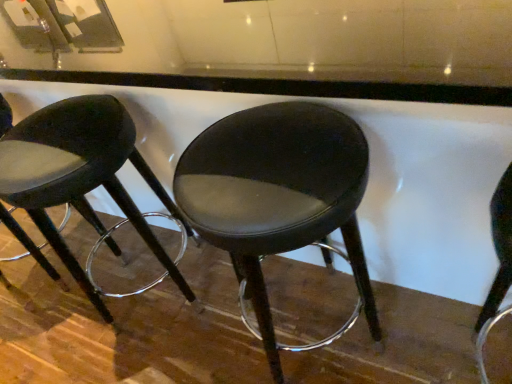
Question: Is matte black stool at center, which is the 1th stool from left to right, taller or shorter than black leather stool at center, the 1th stool when ordered from right to left?

Choices:
 (A) tall
 (B) short

Answer: (B)

Question: From a real-world perspective, is matte black stool at center, which is the 1th stool from left to right, physically located above or below black leather stool at center, the 1th stool when ordered from right to left?

Choices:
 (A) below
 (B) above

Answer: (B)

Question: In the image, is matte black stool at center, which is the 1th stool from left to right, on the left side or the right side of black leather stool at center, the 1th stool when ordered from right to left?

Choices:
 (A) left
 (B) right

Answer: (A)

Question: From the image's perspective, is black leather stool at center, the 1th stool when ordered from right to left, located above or below matte black stool at center, which is the 1th stool from left to right?

Choices:
 (A) below
 (B) above

Answer: (A)

Question: Is black leather stool at center, the 2th stool in the left-to-right sequence, situated inside matte black stool at center, the second stool in the right-to-left sequence, or outside?

Choices:
 (A) outside
 (B) inside

Answer: (A)

Question: In the image, is black leather stool at center, the 2th stool in the left-to-right sequence, positioned in front of or behind matte black stool at center, which is the 1th stool from left to right?

Choices:
 (A) behind
 (B) front

Answer: (B)

Question: Looking at their shapes, would you say black leather stool at center, the 2th stool in the left-to-right sequence, is wider or thinner than matte black stool at center, which is the 1th stool from left to right?

Choices:
 (A) wide
 (B) thin

Answer: (B)